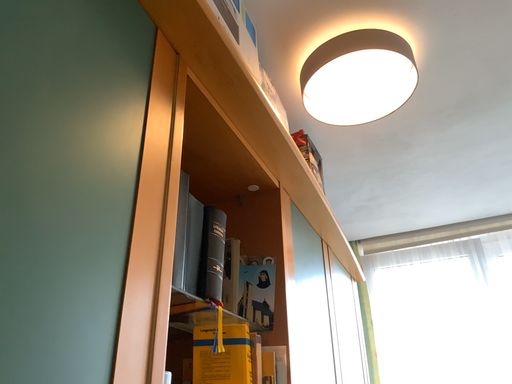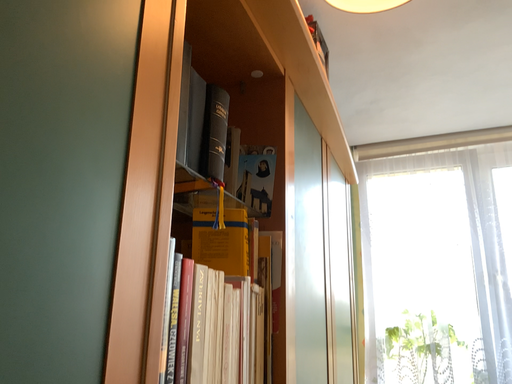
Question: How did the camera likely rotate when shooting the video?

Choices:
 (A) rotated downward
 (B) rotated upward

Answer: (A)